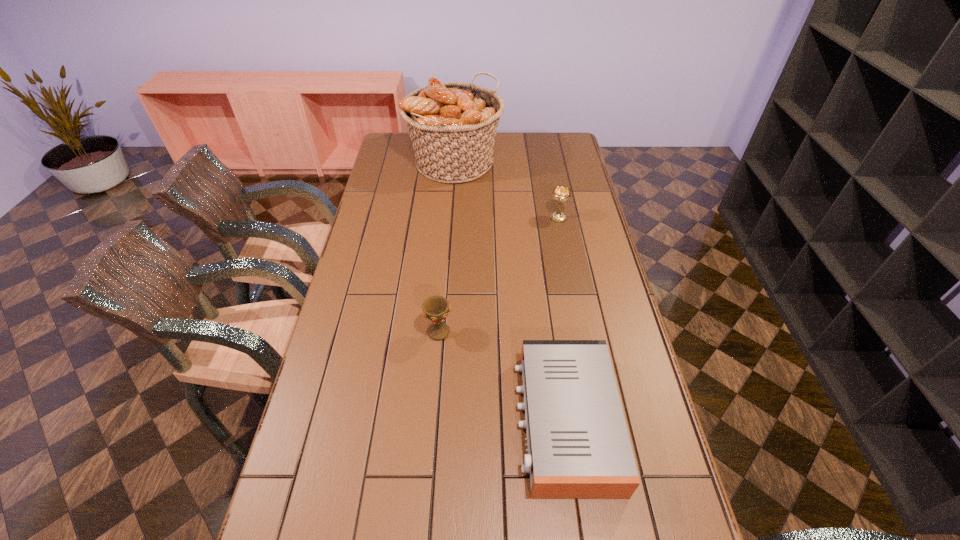
Identify the location of free space that is in between the shortest object and the second nearest object. (502, 376).

At what (x,y) coordinates should I click in order to perform the action: click on free area in between the basket and the left chalice. Please return your answer as a coordinate pair (x, y). This screenshot has height=540, width=960. Looking at the image, I should click on (446, 247).

Identify the location of object that is the second closest to the nearer chalice. This screenshot has width=960, height=540. 561,194.

You are a GUI agent. You are given a task and a screenshot of the screen. Output one action in this format:
    pyautogui.click(x=<x>, y=<y>)
    Task: Click on the second closest object to the left chalice
    
    Given the screenshot: What is the action you would take?
    pyautogui.click(x=561, y=194)

This screenshot has height=540, width=960. I want to click on free space that satisfies the following two spatial constraints: 1. on the front side of the farthest object; 2. on the left side of the right chalice, so click(450, 218).